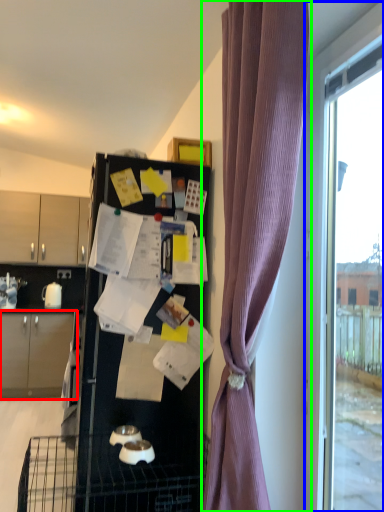
Question: Based on their relative distances, which object is nearer to cabinetry (highlighted by a red box)? Choose from window (highlighted by a blue box) and curtain (highlighted by a green box).

Choices:
 (A) window
 (B) curtain

Answer: (B)